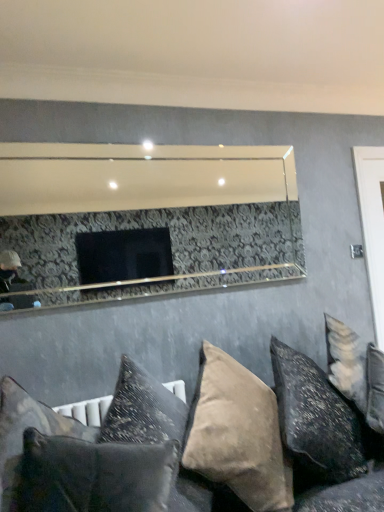
Question: Which direction should I rotate to look at suede-like beige pillow at lower center, arranged as the second pillow when viewed from the right, — up or down?

Choices:
 (A) down
 (B) up

Answer: (A)

Question: Considering the relative positions of velvet cushions at lower center and textured gray pillow at lower center, acting as the fourth pillow starting from the right, in the image provided, is velvet cushions at lower center to the right of textured gray pillow at lower center, acting as the fourth pillow starting from the right, from the viewer's perspective?

Choices:
 (A) yes
 (B) no

Answer: (A)

Question: From the image's perspective, is velvet cushions at lower center located above textured gray pillow at lower center, which is the 2th pillow from left to right?

Choices:
 (A) yes
 (B) no

Answer: (B)

Question: Is velvet cushions at lower center positioned beyond the bounds of textured gray pillow at lower center, acting as the fourth pillow starting from the right?

Choices:
 (A) no
 (B) yes

Answer: (B)

Question: Is velvet cushions at lower center facing away from textured gray pillow at lower center, acting as the fourth pillow starting from the right?

Choices:
 (A) no
 (B) yes

Answer: (A)

Question: Is velvet cushions at lower center in front of textured gray pillow at lower center, which is the 2th pillow from left to right?

Choices:
 (A) yes
 (B) no

Answer: (A)

Question: Can you confirm if velvet cushions at lower center is smaller than textured gray pillow at lower center, which is the 2th pillow from left to right?

Choices:
 (A) yes
 (B) no

Answer: (B)

Question: Is suede-like beige pillow at lower center, arranged as the second pillow when viewed from the right, at the left side of white glossy door at right?

Choices:
 (A) yes
 (B) no

Answer: (A)

Question: Is suede-like beige pillow at lower center, arranged as the second pillow when viewed from the right, looking in the opposite direction of white glossy door at right?

Choices:
 (A) no
 (B) yes

Answer: (A)

Question: Can you confirm if suede-like beige pillow at lower center, arranged as the second pillow when viewed from the right, is smaller than white glossy door at right?

Choices:
 (A) yes
 (B) no

Answer: (B)

Question: Considering the relative sizes of suede-like beige pillow at lower center, arranged as the second pillow when viewed from the right, and white glossy door at right in the image provided, is suede-like beige pillow at lower center, arranged as the second pillow when viewed from the right, wider than white glossy door at right?

Choices:
 (A) yes
 (B) no

Answer: (A)

Question: From the image's perspective, does suede-like beige pillow at lower center, which is counted as the 4th pillow, starting from the left, appear lower than white glossy door at right?

Choices:
 (A) no
 (B) yes

Answer: (B)

Question: Is the depth of suede-like beige pillow at lower center, which is counted as the 4th pillow, starting from the left, less than that of white glossy door at right?

Choices:
 (A) no
 (B) yes

Answer: (B)

Question: Does suede-like beige pillow at lower center, arranged as the second pillow when viewed from the right, turn towards textured gray pillow at lower center, acting as the fourth pillow starting from the right?

Choices:
 (A) no
 (B) yes

Answer: (A)